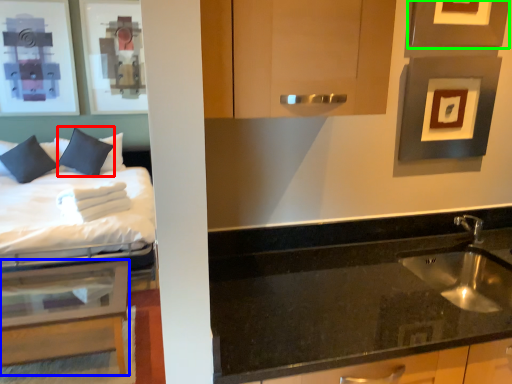
Question: Considering the real-world distances, which object is closest to pillow (highlighted by a red box)? table (highlighted by a blue box) or picture frame (highlighted by a green box).

Choices:
 (A) table
 (B) picture frame

Answer: (A)